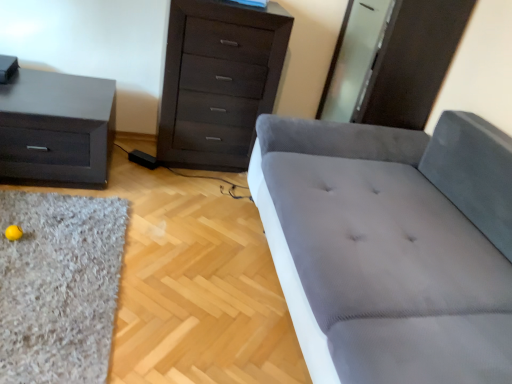
The height and width of the screenshot is (384, 512). In order to click on free space in front of dark wood chest of drawers at upper center in this screenshot , I will do `click(189, 198)`.